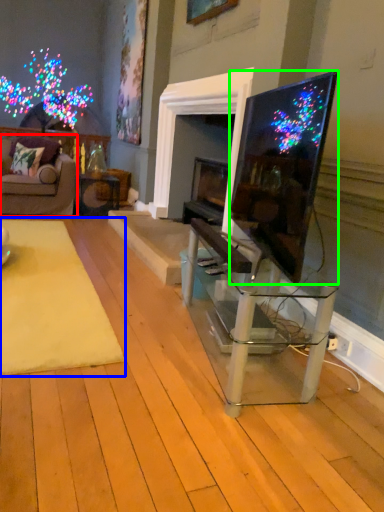
Question: Which is farther away from studio couch (highlighted by a red box)? mat (highlighted by a blue box) or television (highlighted by a green box)?

Choices:
 (A) mat
 (B) television

Answer: (B)